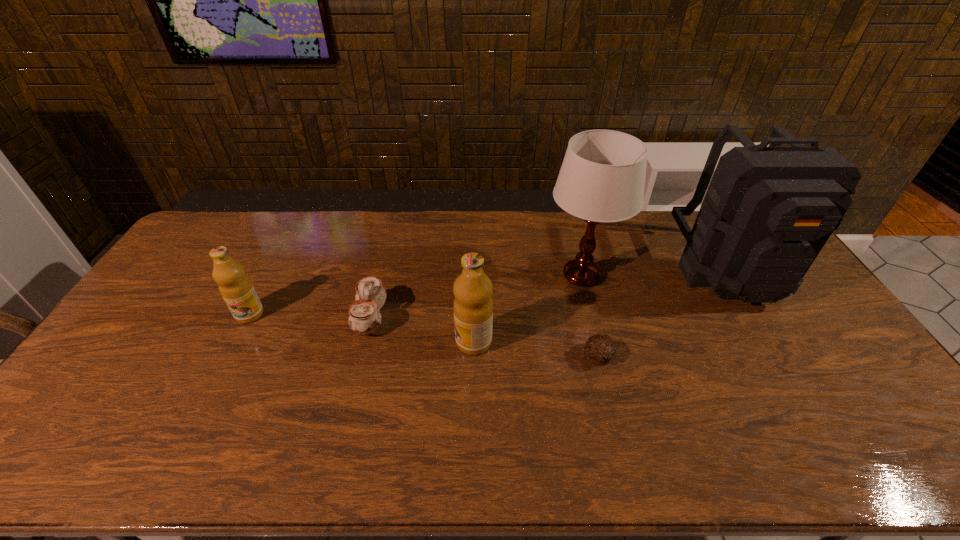
In order to click on the fourth tallest object in this screenshot , I will do `click(236, 288)`.

Locate an element on the screen. The width and height of the screenshot is (960, 540). the leftmost object is located at coordinates (236, 288).

Where is `the nearer olive oil`? The height and width of the screenshot is (540, 960). the nearer olive oil is located at coordinates (473, 307).

The width and height of the screenshot is (960, 540). Identify the location of the fourth shortest object. click(x=473, y=307).

This screenshot has width=960, height=540. What are the coordinates of `the fifth object from right to left` in the screenshot? It's located at (365, 318).

At what (x,y) coordinates should I click in order to perform the action: click on the second shortest object. Please return your answer as a coordinate pair (x, y). The image size is (960, 540). Looking at the image, I should click on point(365,318).

You are a GUI agent. You are given a task and a screenshot of the screen. Output one action in this format:
    pyautogui.click(x=<x>, y=<y>)
    Task: Click on the rightmost object
    The height and width of the screenshot is (540, 960).
    Given the screenshot: What is the action you would take?
    pyautogui.click(x=768, y=211)

Identify the location of the shortest object. This screenshot has height=540, width=960. (600, 349).

Where is `table lamp`? The height and width of the screenshot is (540, 960). table lamp is located at coordinates (602, 178).

Identify the location of vacant space located 0.220m on the label of the left olive oil. (211, 389).